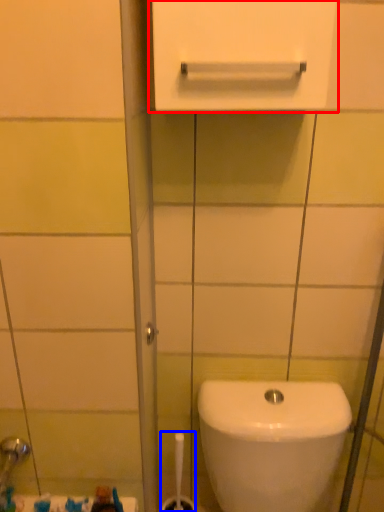
Question: Which point is further to the camera, medicine cabinet (highlighted by a red box) or brush (highlighted by a blue box)?

Choices:
 (A) medicine cabinet
 (B) brush

Answer: (B)